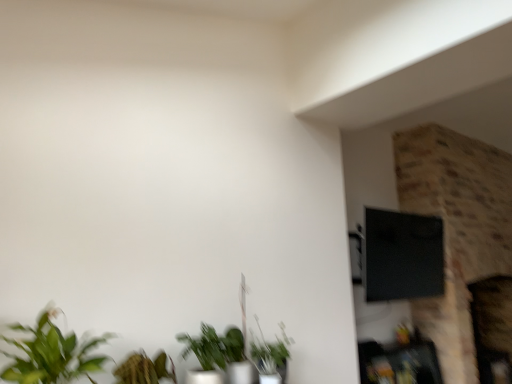
In the scene shown: What is the approximate width of green matte plant at lower center, the 1th houseplant positioned from the back?

It is 27.71 centimeters.

Describe the element at coordinates (220, 353) in the screenshot. I see `green matte plant at lower center, the second houseplant in the front-to-back sequence` at that location.

Locate an element on the screen. This screenshot has height=384, width=512. green matte plant at lower center, which appears as the first houseplant when viewed from the right is located at coordinates (271, 356).

Is the surface of green leafy plant at lower left, which is the 1th houseplant in left-to-right order, in direct contact with green matte plant at lower center, the third houseplant positioned from the left?

No, green leafy plant at lower left, which is the 1th houseplant in left-to-right order, is not next to green matte plant at lower center, the third houseplant positioned from the left.

How distant is green leafy plant at lower left, which appears as the 3th houseplant when viewed from the back, from green matte plant at lower center, the third houseplant viewed from the front?

The distance of green leafy plant at lower left, which appears as the 3th houseplant when viewed from the back, from green matte plant at lower center, the third houseplant viewed from the front, is 37.62 inches.

From the image's perspective, is green leafy plant at lower left, the first houseplant viewed from the front, located beneath green matte plant at lower center, the third houseplant positioned from the left?

Actually, green leafy plant at lower left, the first houseplant viewed from the front, appears above green matte plant at lower center, the third houseplant positioned from the left, in the image.

From a real-world perspective, relative to green matte plant at lower center, the third houseplant viewed from the front, is green leafy plant at lower left, which is the third houseplant in right-to-left order, vertically above or below?

In terms of real-world spatial position, green leafy plant at lower left, which is the third houseplant in right-to-left order, is above green matte plant at lower center, the third houseplant viewed from the front.

Would you say green matte plant at lower center, the second houseplant in the front-to-back sequence, is to the left or to the right of wooden shelf at lower right in the picture?

green matte plant at lower center, the second houseplant in the front-to-back sequence, is positioned on wooden shelf at lower right's left side.

Does green matte plant at lower center, the second houseplant in the front-to-back sequence, lie behind wooden shelf at lower right?

No, green matte plant at lower center, the second houseplant in the front-to-back sequence, is closer to the camera.

At what (x,y) coordinates should I click in order to perform the action: click on furniture that is below the green matte plant at lower center, positioned as the second houseplant in left-to-right order (from the image's perspective). Please return your answer as a coordinate pair (x, y). The width and height of the screenshot is (512, 384). Looking at the image, I should click on click(x=399, y=363).

Is green matte plant at lower center, positioned as the second houseplant in left-to-right order, bigger than wooden shelf at lower right?

No, green matte plant at lower center, positioned as the second houseplant in left-to-right order, is not bigger than wooden shelf at lower right.

Are wooden shelf at lower right and green matte plant at lower center, the 1th houseplant positioned from the back, located far from each other?

Yes, wooden shelf at lower right and green matte plant at lower center, the 1th houseplant positioned from the back, are located far from each other.

From a real-world perspective, does wooden shelf at lower right sit lower than green matte plant at lower center, the third houseplant positioned from the left?

Indeed, from a real-world perspective, wooden shelf at lower right is positioned beneath green matte plant at lower center, the third houseplant positioned from the left.

Can you confirm if wooden shelf at lower right is positioned to the right of green matte plant at lower center, the 1th houseplant positioned from the back?

Indeed, wooden shelf at lower right is positioned on the right side of green matte plant at lower center, the 1th houseplant positioned from the back.

Is wooden shelf at lower right oriented towards green matte plant at lower center, the third houseplant positioned from the left?

No, wooden shelf at lower right is not facing towards green matte plant at lower center, the third houseplant positioned from the left.

Which of these two, green matte plant at lower center, the third houseplant viewed from the front, or green leafy plant at lower left, which appears as the 3th houseplant when viewed from the back, is bigger?

green leafy plant at lower left, which appears as the 3th houseplant when viewed from the back, is bigger.

From a real-world perspective, is green matte plant at lower center, the third houseplant viewed from the front, on green leafy plant at lower left, which is the third houseplant in right-to-left order?

Actually, green matte plant at lower center, the third houseplant viewed from the front, is physically below green leafy plant at lower left, which is the third houseplant in right-to-left order, in the real world.

Is green matte plant at lower center, the 1th houseplant positioned from the back, looking in the opposite direction of green leafy plant at lower left, which is the 1th houseplant in left-to-right order?

green matte plant at lower center, the 1th houseplant positioned from the back, is not turned away from green leafy plant at lower left, which is the 1th houseplant in left-to-right order.

Can you confirm if green matte plant at lower center, the 1th houseplant positioned from the back, is thinner than green leafy plant at lower left, which is the 1th houseplant in left-to-right order?

Yes.

Who is bigger, green leafy plant at lower left, which is the 1th houseplant in left-to-right order, or wooden shelf at lower right?

wooden shelf at lower right is bigger.

Is green leafy plant at lower left, which is the 1th houseplant in left-to-right order, looking in the opposite direction of wooden shelf at lower right?

No, wooden shelf at lower right is not at the back of green leafy plant at lower left, which is the 1th houseplant in left-to-right order.

Is green leafy plant at lower left, the first houseplant viewed from the front, at the left side of wooden shelf at lower right?

Correct, you'll find green leafy plant at lower left, the first houseplant viewed from the front, to the left of wooden shelf at lower right.

Is wooden shelf at lower right inside green leafy plant at lower left, the first houseplant viewed from the front?

No, green leafy plant at lower left, the first houseplant viewed from the front, does not contain wooden shelf at lower right.

The width and height of the screenshot is (512, 384). I want to click on houseplant behind the green matte plant at lower center, the second houseplant in the front-to-back sequence, so click(x=271, y=356).

Based on the photo, is green matte plant at lower center, the third houseplant viewed from the front, looking in the opposite direction of green matte plant at lower center, the second houseplant in the front-to-back sequence?

green matte plant at lower center, the third houseplant viewed from the front, is not turned away from green matte plant at lower center, the second houseplant in the front-to-back sequence.

Which of these two, green matte plant at lower center, which appears as the first houseplant when viewed from the right, or green matte plant at lower center, positioned as the second houseplant in left-to-right order, stands shorter?

green matte plant at lower center, which appears as the first houseplant when viewed from the right, is shorter.

Which is more to the left, green matte plant at lower center, the third houseplant viewed from the front, or green matte plant at lower center, arranged as the 2th houseplant when viewed from the right?

Positioned to the left is green matte plant at lower center, arranged as the 2th houseplant when viewed from the right.

Which is behind, green matte plant at lower center, positioned as the second houseplant in left-to-right order, or green leafy plant at lower left, the first houseplant viewed from the front?

green matte plant at lower center, positioned as the second houseplant in left-to-right order, is further from the camera.

Does green matte plant at lower center, the second houseplant in the front-to-back sequence, have a larger size compared to green leafy plant at lower left, which is the 1th houseplant in left-to-right order?

No, green matte plant at lower center, the second houseplant in the front-to-back sequence, is not bigger than green leafy plant at lower left, which is the 1th houseplant in left-to-right order.

Which is correct: green matte plant at lower center, the second houseplant in the front-to-back sequence, is inside green leafy plant at lower left, which appears as the 3th houseplant when viewed from the back, or outside of it?

green matte plant at lower center, the second houseplant in the front-to-back sequence, is outside green leafy plant at lower left, which appears as the 3th houseplant when viewed from the back.

Does green matte plant at lower center, arranged as the 2th houseplant when viewed from the right, appear on the left side of green leafy plant at lower left, which is the third houseplant in right-to-left order?

No.

Which houseplant is the 2nd one when counting from the front of the green matte plant at lower center, the third houseplant positioned from the left? Please provide its 2D coordinates.

[(51, 353)]

Where is `furniture behind the green matte plant at lower center, positioned as the second houseplant in left-to-right order`? This screenshot has width=512, height=384. furniture behind the green matte plant at lower center, positioned as the second houseplant in left-to-right order is located at coordinates tap(399, 363).

From the image, which object appears to be farther from green leafy plant at lower left, which is the third houseplant in right-to-left order, green matte plant at lower center, positioned as the second houseplant in left-to-right order, or green matte plant at lower center, which appears as the first houseplant when viewed from the right?

The object further to green leafy plant at lower left, which is the third houseplant in right-to-left order, is green matte plant at lower center, which appears as the first houseplant when viewed from the right.

From the image, which object appears to be farther from green matte plant at lower center, positioned as the second houseplant in left-to-right order, green leafy plant at lower left, which is the 1th houseplant in left-to-right order, or green matte plant at lower center, the 1th houseplant positioned from the back?

green leafy plant at lower left, which is the 1th houseplant in left-to-right order, is further to green matte plant at lower center, positioned as the second houseplant in left-to-right order.

Looking at the image, which one is located further to wooden shelf at lower right, green matte plant at lower center, the second houseplant in the front-to-back sequence, or green leafy plant at lower left, which is the 1th houseplant in left-to-right order?

The object further to wooden shelf at lower right is green leafy plant at lower left, which is the 1th houseplant in left-to-right order.

Looking at the image, which one is located closer to green matte plant at lower center, the third houseplant viewed from the front, green leafy plant at lower left, the first houseplant viewed from the front, or wooden shelf at lower right?

green leafy plant at lower left, the first houseplant viewed from the front.

Estimate the real-world distances between objects in this image. Which object is closer to wooden shelf at lower right, green matte plant at lower center, the 1th houseplant positioned from the back, or green matte plant at lower center, positioned as the second houseplant in left-to-right order?

Based on the image, green matte plant at lower center, the 1th houseplant positioned from the back, appears to be nearer to wooden shelf at lower right.

Estimate the real-world distances between objects in this image. Which object is further from green matte plant at lower center, the third houseplant viewed from the front, green matte plant at lower center, the second houseplant in the front-to-back sequence, or wooden shelf at lower right?

Among the two, wooden shelf at lower right is located further to green matte plant at lower center, the third houseplant viewed from the front.

Which object lies nearer to the anchor point green matte plant at lower center, the 1th houseplant positioned from the back, green matte plant at lower center, the 2th houseplant viewed from the back, or green leafy plant at lower left, which appears as the 3th houseplant when viewed from the back?

green matte plant at lower center, the 2th houseplant viewed from the back, is positioned closer to the anchor green matte plant at lower center, the 1th houseplant positioned from the back.

From the image, which object appears to be farther from green matte plant at lower center, arranged as the 2th houseplant when viewed from the right, green matte plant at lower center, the third houseplant positioned from the left, or wooden shelf at lower right?

The object further to green matte plant at lower center, arranged as the 2th houseplant when viewed from the right, is wooden shelf at lower right.

At what (x,y) coordinates should I click in order to perform the action: click on houseplant situated between green matte plant at lower center, the 2th houseplant viewed from the back, and wooden shelf at lower right from left to right. Please return your answer as a coordinate pair (x, y). This screenshot has width=512, height=384. Looking at the image, I should click on (271, 356).

Find the location of a particular element. This screenshot has height=384, width=512. houseplant located between green leafy plant at lower left, which is the 1th houseplant in left-to-right order, and green matte plant at lower center, the third houseplant positioned from the left, in the depth direction is located at coordinates (220, 353).